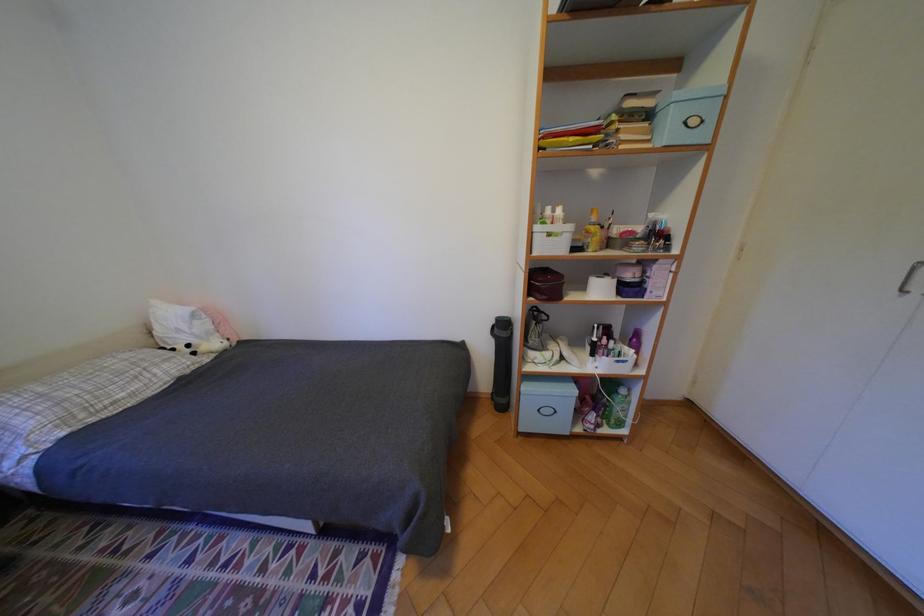
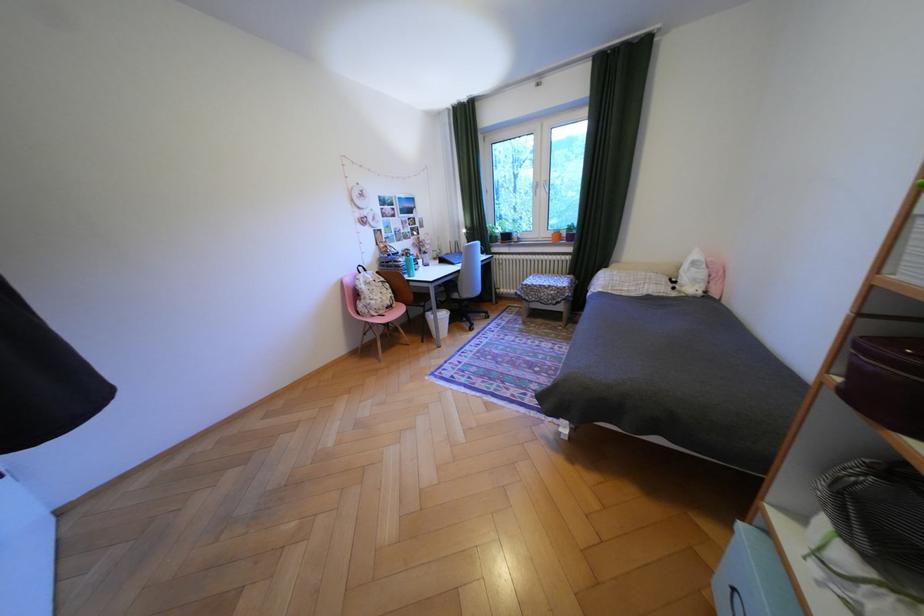
Find the pixel in the second image that matches pixel 551 411 in the first image.

(746, 591)